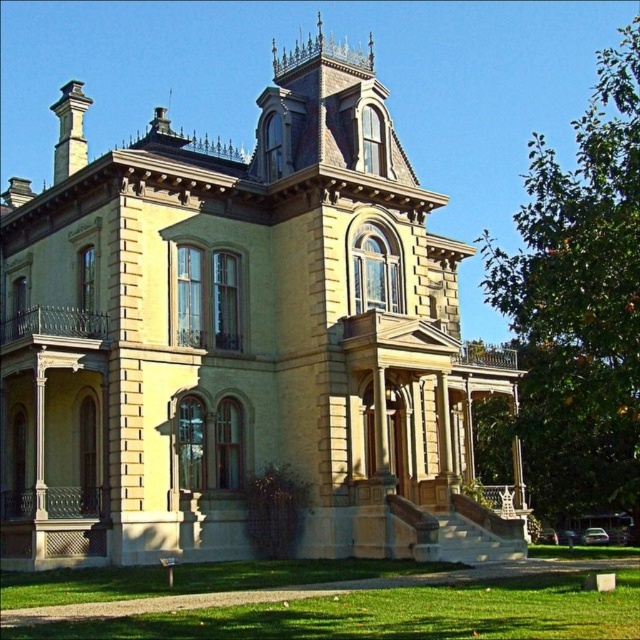
Between yellow stone mansion at center and green grass at lower center, which one has more height?

With more height is yellow stone mansion at center.

Can you confirm if yellow stone mansion at center is thinner than green grass at lower center?

No, yellow stone mansion at center is not thinner than green grass at lower center.

Is point (1, 348) positioned before point (342, 586)?

That is False.

Where is `yellow stone mansion at center`? This screenshot has height=640, width=640. yellow stone mansion at center is located at coordinates (241, 339).